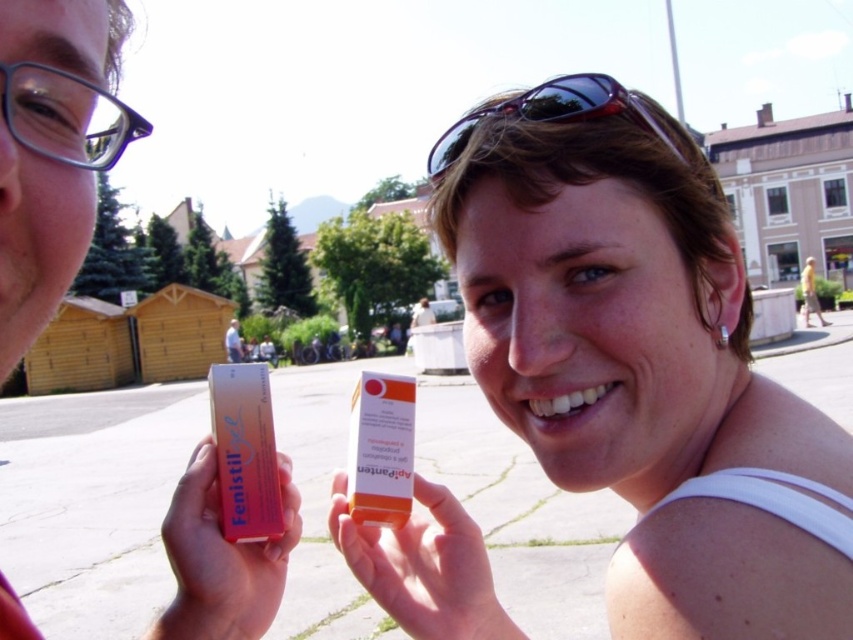
Who is shorter, orange plastic tube at center or matte plastic box at lower left?

orange plastic tube at center is shorter.

Can you confirm if orange plastic tube at center is positioned above matte plastic box at lower left?

No.

Is point (432, 513) in front of point (229, 605)?

No.

Where is `orange plastic tube at center`? orange plastic tube at center is located at coordinates (424, 566).

Is matte plastic box at lower left bigger than clear plastic glasses at upper left?

No.

Who is taller, matte plastic box at lower left or clear plastic glasses at upper left?

With more height is matte plastic box at lower left.

Locate an element on the screen. matte plastic box at lower left is located at coordinates (221, 560).

You are a GUI agent. You are given a task and a screenshot of the screen. Output one action in this format:
    pyautogui.click(x=<x>, y=<y>)
    Task: Click on the matte plastic box at lower left
    
    Given the screenshot: What is the action you would take?
    pyautogui.click(x=221, y=560)

Between matte plastic box at left and orange plastic tube at center, which one is positioned lower?

orange plastic tube at center is lower down.

Does matte plastic box at left lie behind orange plastic tube at center?

No.

Where is `matte plastic box at left`? The height and width of the screenshot is (640, 853). matte plastic box at left is located at coordinates (51, 150).